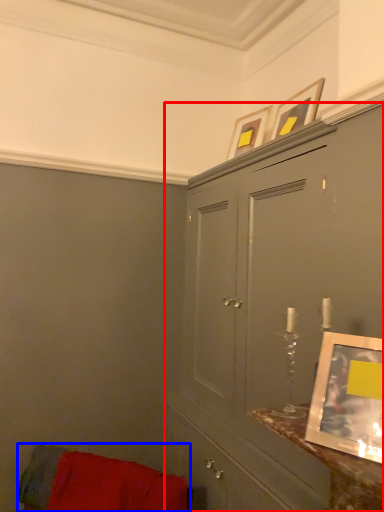
Question: Which object is closer to the camera taking this photo, cabinetry (highlighted by a red box) or furniture (highlighted by a blue box)?

Choices:
 (A) cabinetry
 (B) furniture

Answer: (A)